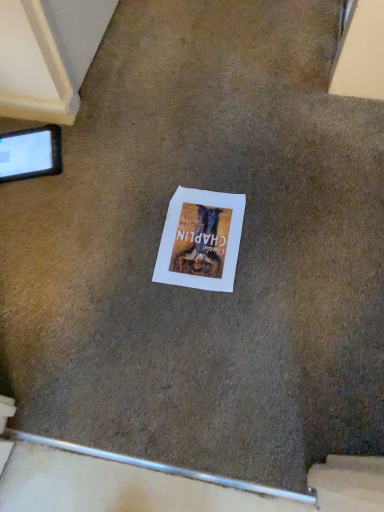
Where is `vacant area on the back side of white paper at center`? vacant area on the back side of white paper at center is located at coordinates (192, 167).